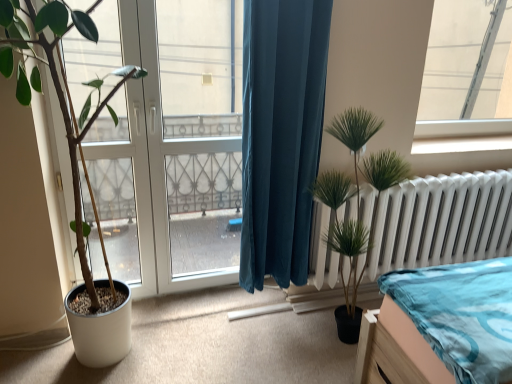
Where is `vacant space underneath transparent glass door at center (from a real-world perspective)`? Image resolution: width=512 pixels, height=384 pixels. vacant space underneath transparent glass door at center (from a real-world perspective) is located at coordinates (204, 295).